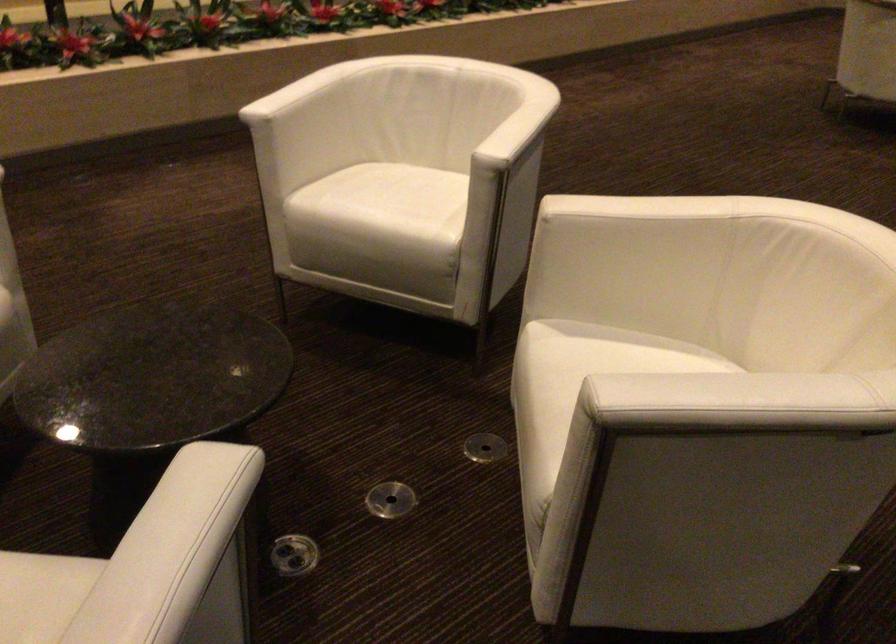
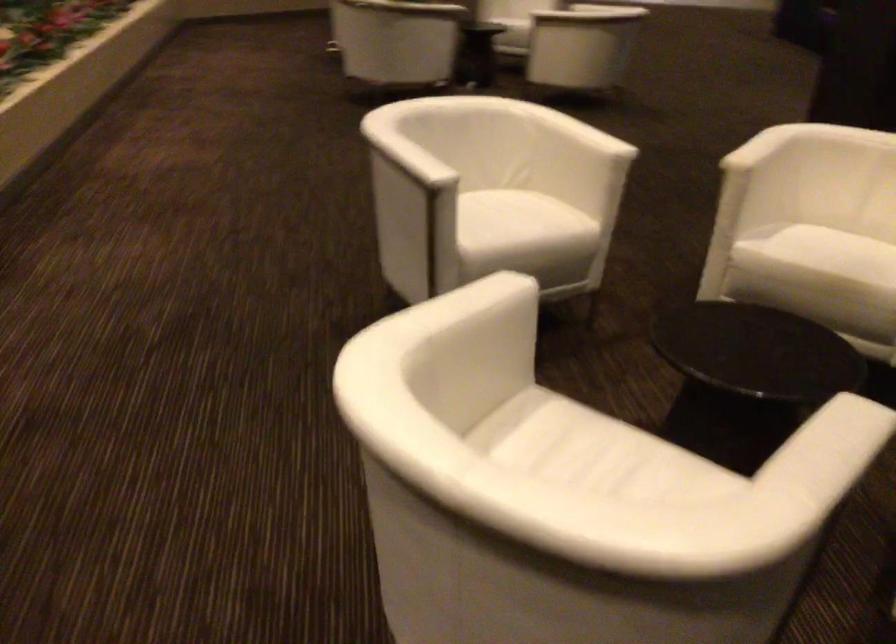
In the second image, find the point that corresponds to [277,90] in the first image.

(406, 158)